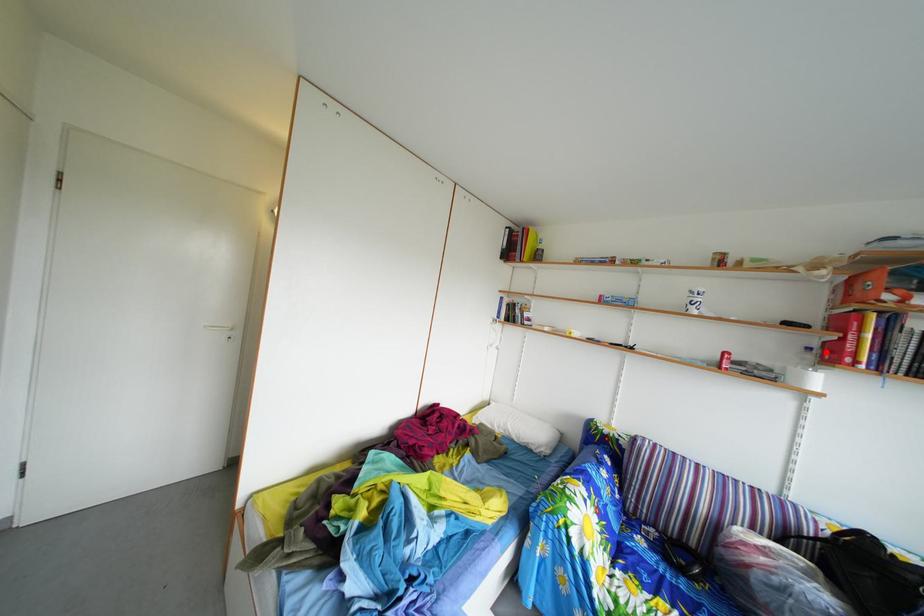
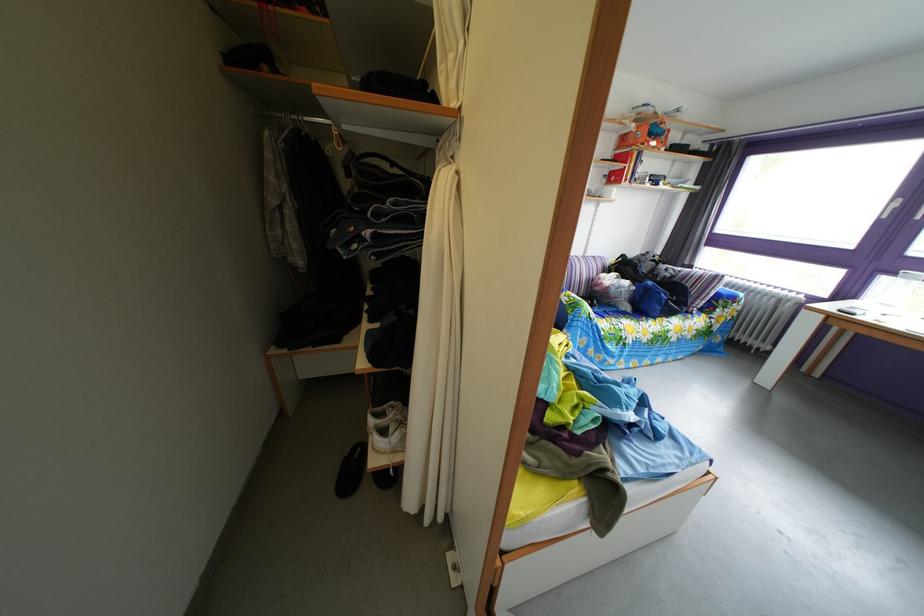
Question: I am providing you with two images of the same scene from different viewpoints. A red point is shown in image1. For the corresponding object point in image2, is it positioned nearer or farther from the camera?

Choices:
 (A) Nearer
 (B) Farther

Answer: (A)